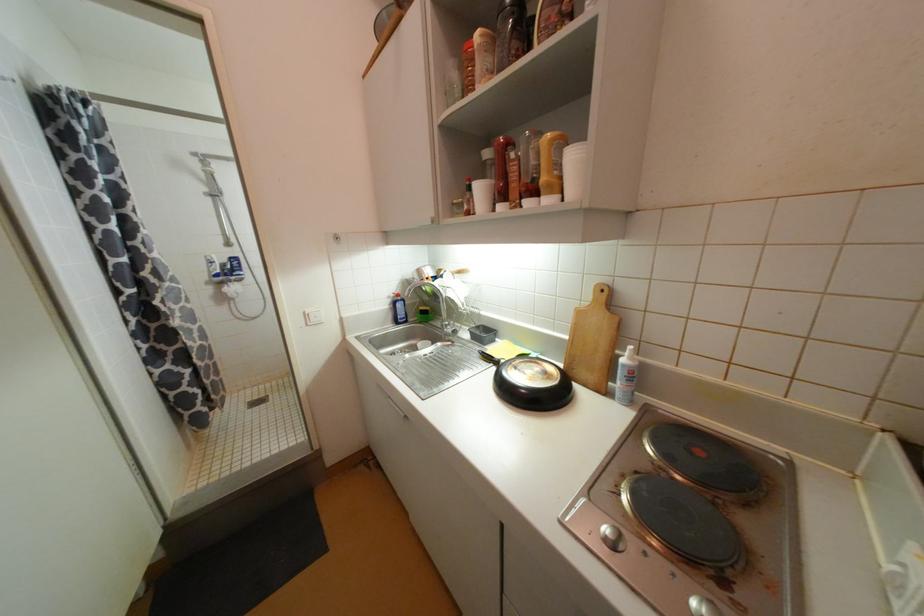
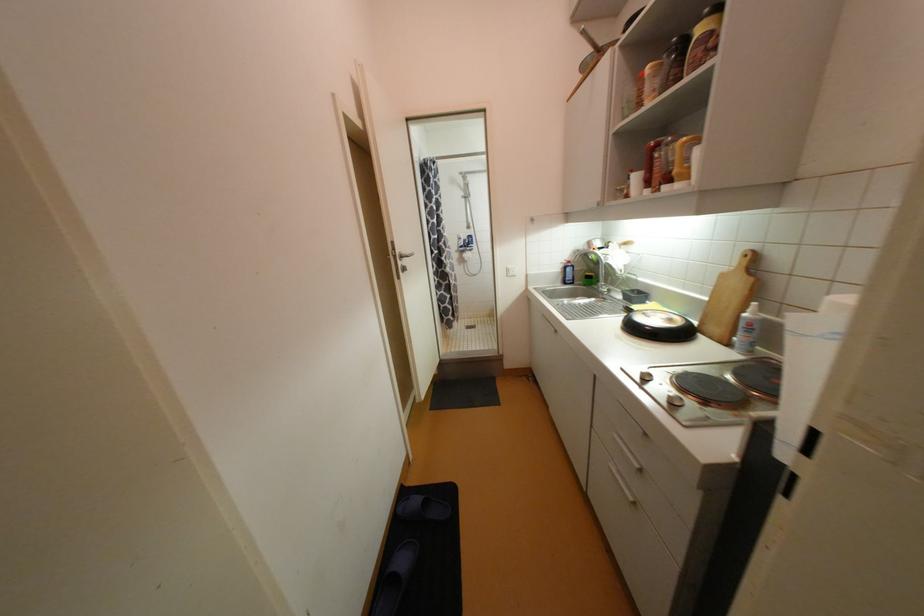
Find the pixel in the second image that matches (310,317) in the first image.

(513, 270)